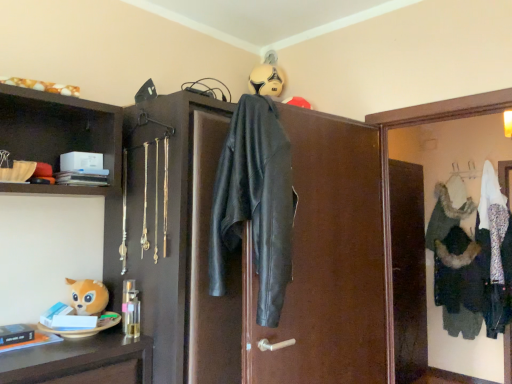
Image resolution: width=512 pixels, height=384 pixels. In order to click on vacant area on top of white fabric medicine cabinet at upper right (from a real-world perspective) in this screenshot , I will do `click(440, 97)`.